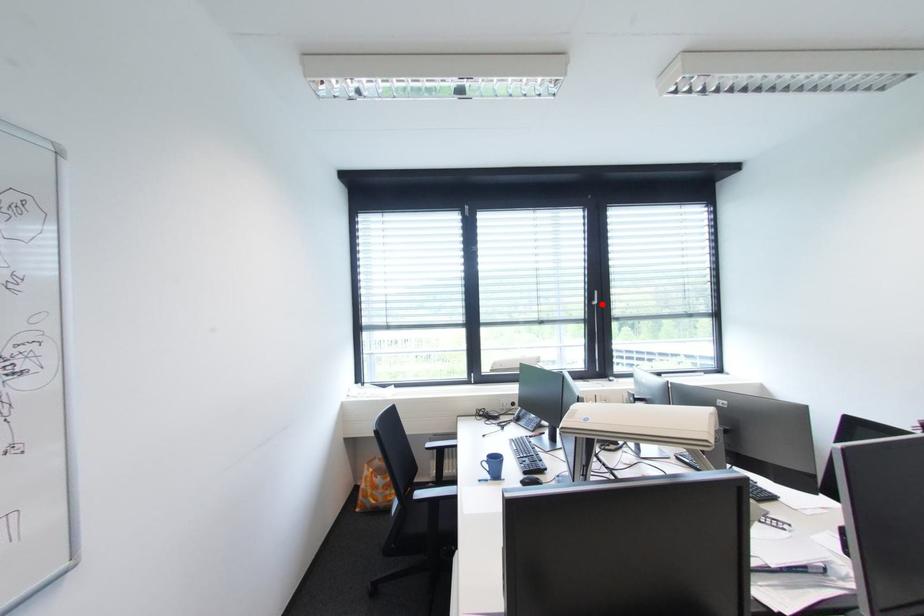
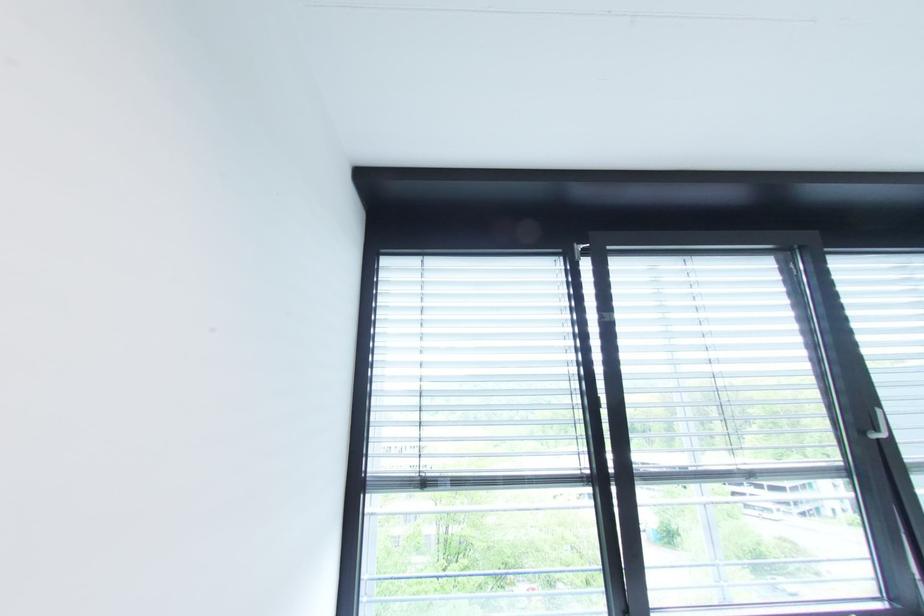
Where in the second image is the point corresponding to the highlighted location from the first image?

(889, 437)